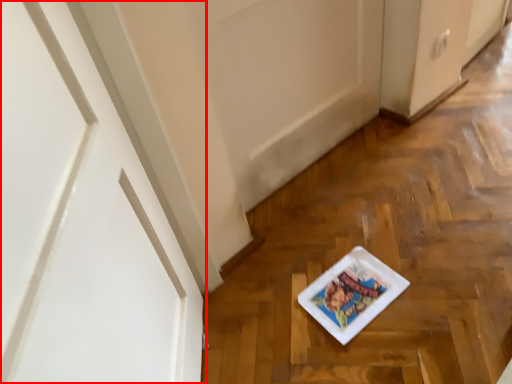
Question: From the image's perspective, where is door (annotated by the red box) located in relation to platter in the image?

Choices:
 (A) above
 (B) below

Answer: (A)